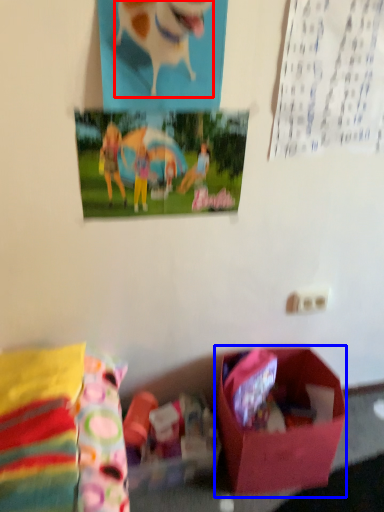
Question: Among these objects, which one is nearest to the camera, animal (highlighted by a red box) or box (highlighted by a blue box)?

Choices:
 (A) animal
 (B) box

Answer: (A)